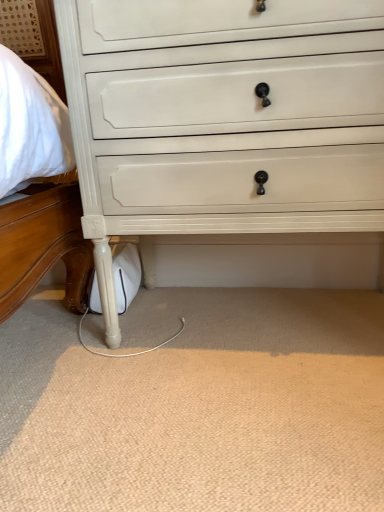
This screenshot has height=512, width=384. What are the coordinates of `white painted wood chest of drawers at center` in the screenshot? It's located at (223, 119).

Image resolution: width=384 pixels, height=512 pixels. What do you see at coordinates (223, 119) in the screenshot?
I see `white painted wood chest of drawers at center` at bounding box center [223, 119].

Locate an element on the screen. white painted wood chest of drawers at center is located at coordinates (223, 119).